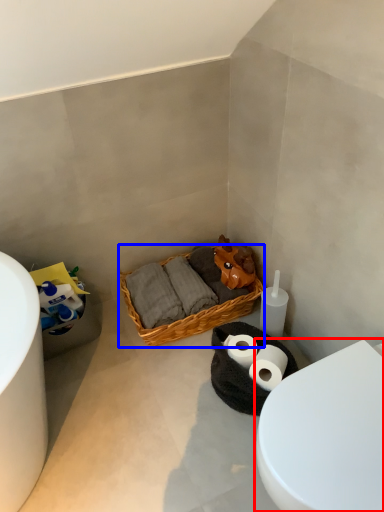
Question: Which point is further to the camera, toilet (highlighted by a red box) or picnic basket (highlighted by a blue box)?

Choices:
 (A) toilet
 (B) picnic basket

Answer: (B)